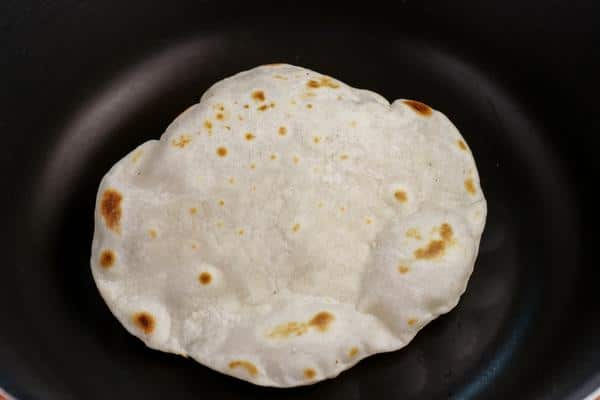
Identify the location of inner ring base of pan. This screenshot has height=400, width=600. (111, 103), (273, 28), (551, 163), (474, 380), (133, 380), (52, 245).